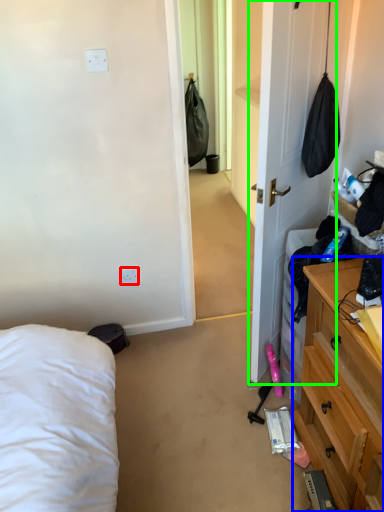
Question: Considering the real-world distances, which object is closest to electric outlet (highlighted by a red box)? cabinetry (highlighted by a blue box) or door (highlighted by a green box).

Choices:
 (A) cabinetry
 (B) door

Answer: (B)